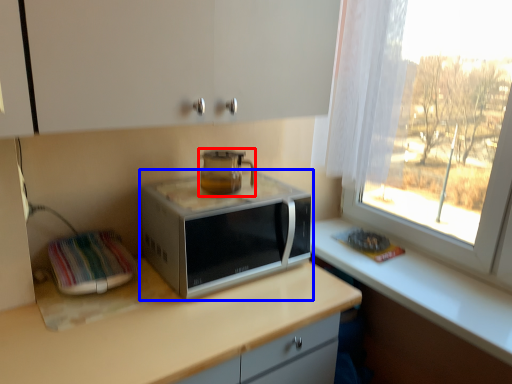
Question: Which of the following is the closest to the observer, home appliance (highlighted by a red box) or microwave oven (highlighted by a blue box)?

Choices:
 (A) home appliance
 (B) microwave oven

Answer: (B)